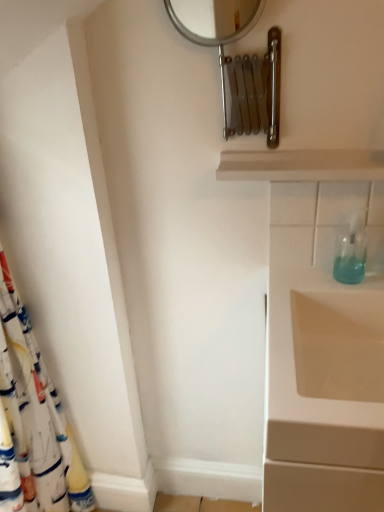
Question: Can you confirm if white fabric shower curtain at left is taller than white wood shelf at upper center?

Choices:
 (A) no
 (B) yes

Answer: (B)

Question: Is white fabric shower curtain at left touching white wood shelf at upper center?

Choices:
 (A) no
 (B) yes

Answer: (A)

Question: Is white fabric shower curtain at left thinner than white wood shelf at upper center?

Choices:
 (A) yes
 (B) no

Answer: (B)

Question: Does white fabric shower curtain at left have a larger size compared to white wood shelf at upper center?

Choices:
 (A) yes
 (B) no

Answer: (A)

Question: Could you tell me if white fabric shower curtain at left is facing white wood shelf at upper center?

Choices:
 (A) no
 (B) yes

Answer: (B)

Question: From a real-world perspective, relative to white fabric shower curtain at left, is transparent plastic soap dispenser at right vertically above or below?

Choices:
 (A) below
 (B) above

Answer: (B)

Question: Is transparent plastic soap dispenser at right bigger or smaller than white fabric shower curtain at left?

Choices:
 (A) small
 (B) big

Answer: (A)

Question: In the image, is transparent plastic soap dispenser at right on the left side or the right side of white fabric shower curtain at left?

Choices:
 (A) right
 (B) left

Answer: (A)

Question: Considering their positions, is transparent plastic soap dispenser at right located in front of or behind white fabric shower curtain at left?

Choices:
 (A) front
 (B) behind

Answer: (B)

Question: Is silver metallic mirror at upper center taller or shorter than white wood shelf at upper center?

Choices:
 (A) tall
 (B) short

Answer: (A)

Question: From a real-world perspective, is silver metallic mirror at upper center positioned above or below white wood shelf at upper center?

Choices:
 (A) below
 (B) above

Answer: (B)

Question: Relative to white wood shelf at upper center, is silver metallic mirror at upper center in front or behind?

Choices:
 (A) front
 (B) behind

Answer: (A)

Question: Is silver metallic mirror at upper center to the left or to the right of white wood shelf at upper center in the image?

Choices:
 (A) right
 (B) left

Answer: (B)

Question: In the image, is white wood shelf at upper center on the left side or the right side of transparent plastic soap dispenser at right?

Choices:
 (A) right
 (B) left

Answer: (B)

Question: Would you say white wood shelf at upper center is inside or outside transparent plastic soap dispenser at right?

Choices:
 (A) inside
 (B) outside

Answer: (B)